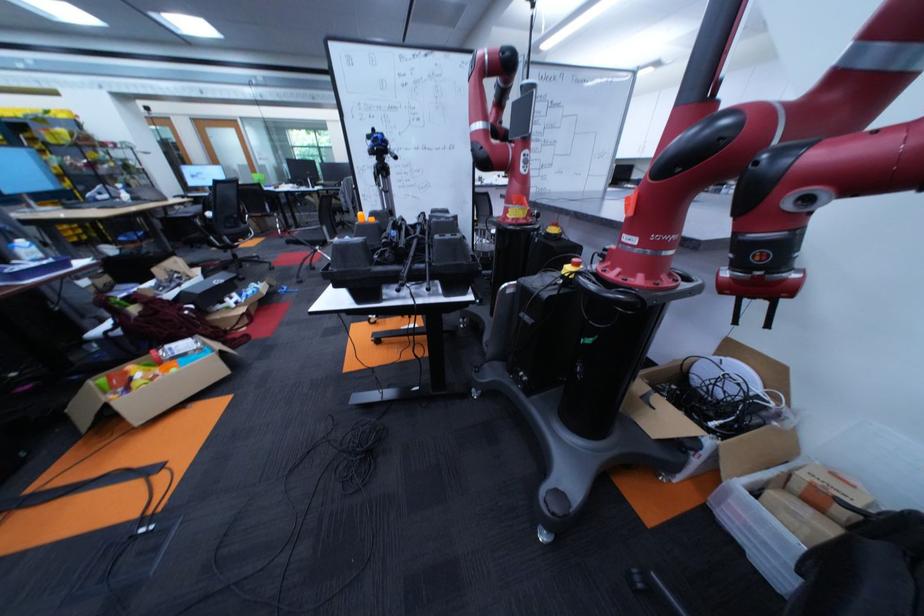
Which object does [760,525] point to?

This point indicates the clear plastic bin.